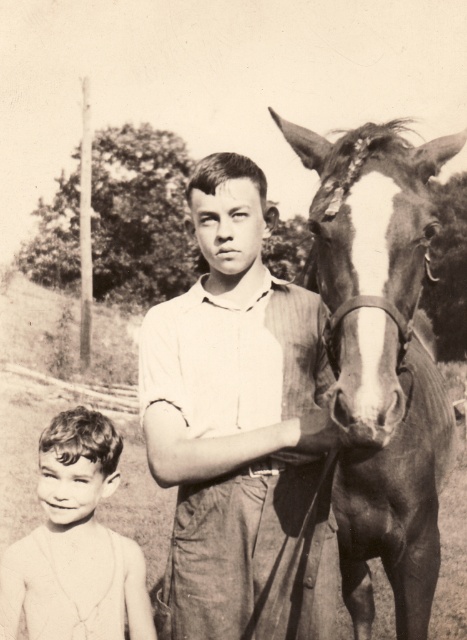
Question: Is white striped shirt at center to the right of smooth skin boy at lower left from the viewer's perspective?

Choices:
 (A) no
 (B) yes

Answer: (B)

Question: Does white striped shirt at center come behind dark brown leather horse at right?

Choices:
 (A) yes
 (B) no

Answer: (A)

Question: Among these points, which one is farthest from the camera?

Choices:
 (A) (332, 531)
 (B) (76, 486)

Answer: (B)

Question: Which object appears closest to the camera in this image?

Choices:
 (A) white striped shirt at center
 (B) smooth skin boy at lower left
 (C) dark brown leather horse at right

Answer: (C)

Question: Which object is positioned closest to the white striped shirt at center?

Choices:
 (A) smooth skin boy at lower left
 (B) dark brown leather horse at right

Answer: (A)

Question: Can you confirm if white striped shirt at center is positioned above smooth skin boy at lower left?

Choices:
 (A) yes
 (B) no

Answer: (A)